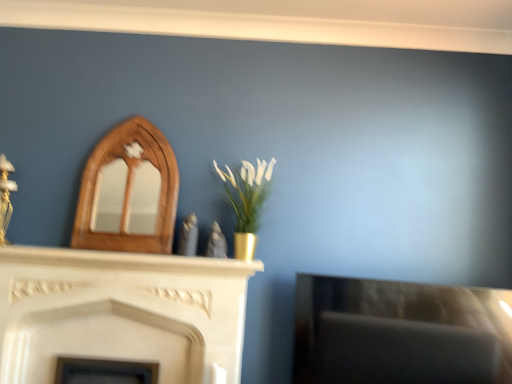
Question: Based on their positions, is wooden mirror at upper left, placed as the 2th fireplace when sorted from bottom to top, located to the left or right of white marble fireplace at center, the 2th fireplace positioned from the top?

Choices:
 (A) right
 (B) left

Answer: (A)

Question: Relative to white marble fireplace at center, the 2th fireplace positioned from the top, is wooden mirror at upper left, placed as the 2th fireplace when sorted from bottom to top, in front or behind?

Choices:
 (A) front
 (B) behind

Answer: (B)

Question: Estimate the real-world distances between objects in this image. Which object is closer to the wooden mirror at upper left, placed as the 2th fireplace when sorted from bottom to top?

Choices:
 (A) gold metallic vase at center
 (B) white marble fireplace at center, the 2th fireplace positioned from the top
 (C) white marble mantle at center

Answer: (C)

Question: Which object is positioned closest to the white marble fireplace at center, which ranks as the first fireplace in bottom-to-top order?

Choices:
 (A) wooden mirror at upper left, which is the first fireplace in top-to-bottom order
 (B) white marble mantle at center
 (C) gold metallic vase at center

Answer: (B)